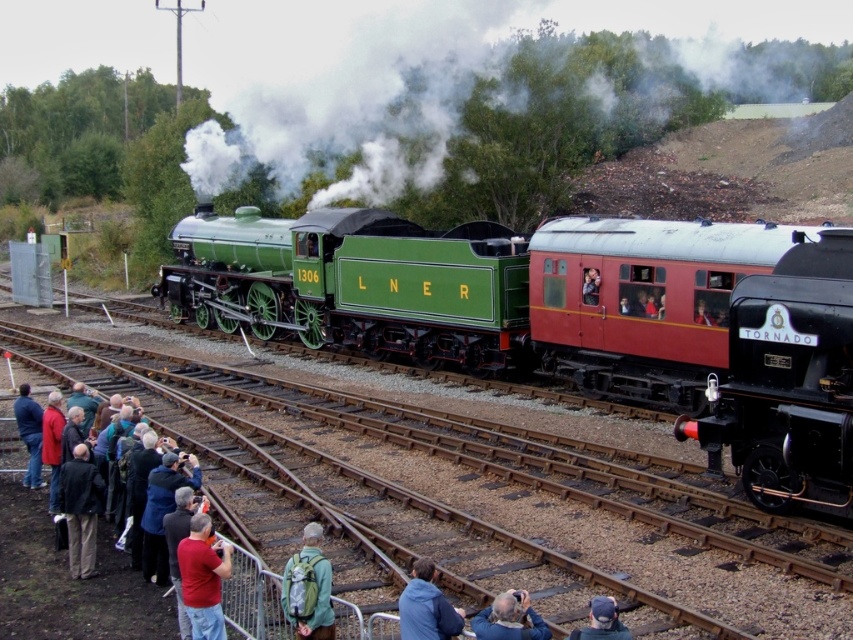
How much distance is there between white vapor steam at upper center and red cotton shirt at lower left?

The distance of white vapor steam at upper center from red cotton shirt at lower left is 41.60 meters.

Is white vapor steam at upper center bigger than red cotton shirt at lower left?

Yes.

Who is more distant from viewer, (508,161) or (218,588)?

Point (508,161)

The image size is (853, 640). Identify the location of white vapor steam at upper center. (479, 104).

Who is more forward, (438, 182) or (16, 397)?

Point (16, 397) is more forward.

Does white vapor steam at upper center appear under red jacket at lower left?

No.

Which is behind, point (779, 19) or point (27, 419)?

Point (779, 19)

The height and width of the screenshot is (640, 853). Identify the location of white vapor steam at upper center. (479, 104).

Is point (811, 241) positioned in front of point (802, 406)?

No, (811, 241) is behind (802, 406).

Between green polished wood train at center and polished black steam locomotive at right, which one has less height?

Standing shorter between the two is polished black steam locomotive at right.

Between point (497, 234) and point (817, 380), which one is positioned behind?

Point (497, 234)

At what (x,y) coordinates should I click in order to perform the action: click on green polished wood train at center. Please return your answer as a coordinate pair (x, y). Looking at the image, I should click on (567, 316).